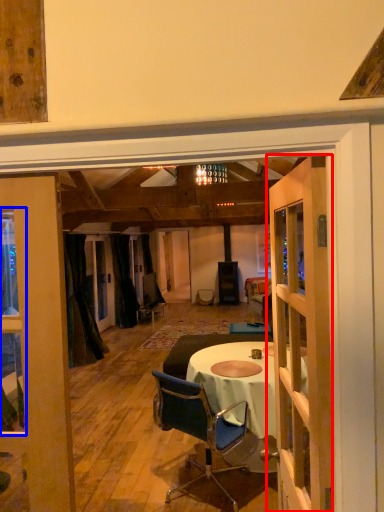
Question: Which point is further to the camera, door (highlighted by a red box) or window (highlighted by a blue box)?

Choices:
 (A) door
 (B) window

Answer: (B)